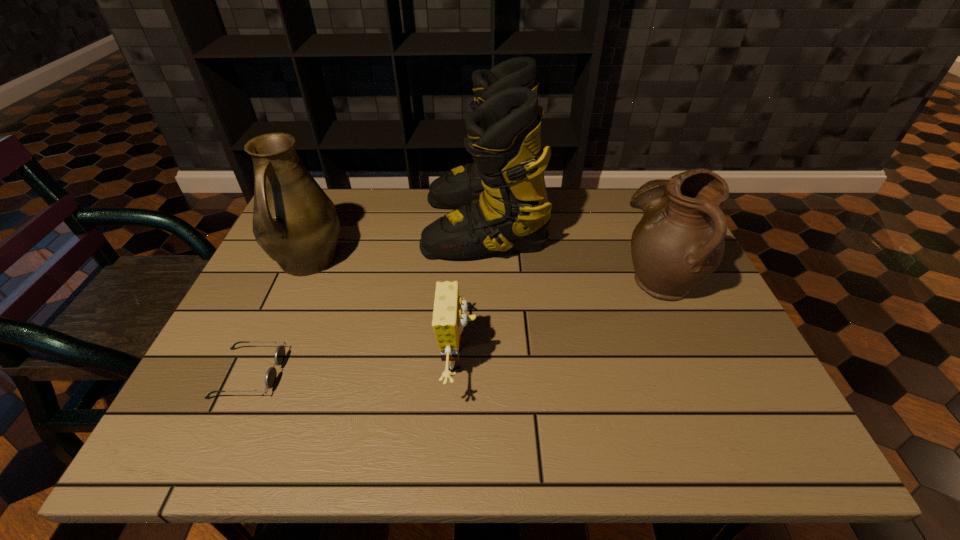
At what (x,y) coordinates should I click in order to perform the action: click on vacant area that lies between the left pitcher and the sponge. Please return your answer as a coordinate pair (x, y). Looking at the image, I should click on (383, 311).

In order to click on free space between the left pitcher and the ski boots in this screenshot , I will do `click(396, 242)`.

Where is `empty space that is in between the tallest object and the sponge`? This screenshot has width=960, height=540. empty space that is in between the tallest object and the sponge is located at coordinates (471, 292).

Where is `the closest object to the right pitcher`? Image resolution: width=960 pixels, height=540 pixels. the closest object to the right pitcher is located at coordinates (501, 201).

Select which object appears as the closest to the right pitcher. Please provide its 2D coordinates. Your answer should be formatted as a tuple, i.e. [(x, y)], where the tuple contains the x and y coordinates of a point satisfying the conditions above.

[(501, 201)]

Find the location of a particular element. blank area in the image that satisfies the following two spatial constraints: 1. on the handle side of the left pitcher; 2. on the front-facing side of the sunglasses is located at coordinates (258, 373).

What are the coordinates of `free spot that satisfies the following two spatial constraints: 1. on the handle side of the left pitcher; 2. on the front-facing side of the shortest object` in the screenshot? It's located at (258, 373).